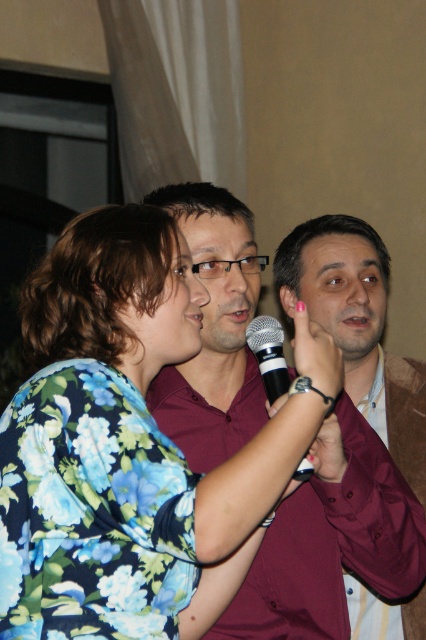
Question: Which point is farther to the camera?

Choices:
 (A) maroon shirt at center
 (B) black matte microphone at center

Answer: (A)

Question: From the image, what is the correct spatial relationship of floral fabric shirt at center in relation to maroon shirt at center?

Choices:
 (A) below
 (B) above

Answer: (B)

Question: Where is floral fabric shirt at center located in relation to maroon shirt at center in the image?

Choices:
 (A) below
 (B) above

Answer: (B)

Question: Which object appears farthest from the camera in this image?

Choices:
 (A) black matte microphone at center
 (B) maroon shirt at center
 (C) floral fabric shirt at center

Answer: (B)

Question: Can you confirm if floral fabric shirt at center is positioned above black matte microphone at center?

Choices:
 (A) no
 (B) yes

Answer: (A)

Question: Which point appears closest to the camera in this image?

Choices:
 (A) (2, 545)
 (B) (259, 340)

Answer: (A)